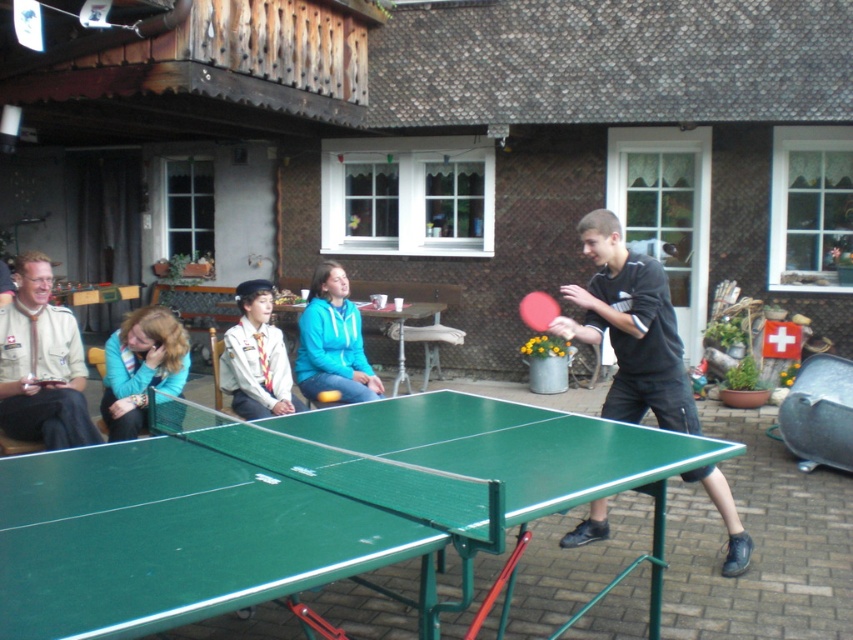
You are standing at the edge of the patio and want to place a large decorative vase between the matte blue jacket at center and the green plastic table tennis table at center. Given that the vase is 1.2 meters wide, can it fit between them?

The matte blue jacket at center has a larger size compared to green plastic table tennis table at center, but the exact distance between them isn t specified. Without knowing the space between the two objects, it s impossible to determine if the vase will fit.

You are standing at the center of the green table tennis table. You want to move to the point marked at coordinate (x=175, y=538). Is this point located on the table?

Yes, the point marked at coordinate (x=175, y=538) is on the green plastic table at center, so you can move there directly.

You are a person who is 5 feet tall. You want to play table tennis with others. Can you comfortably stand between the matte blue jacket at center and the green plastic table tennis table at center without feeling cramped?

The distance between the matte blue jacket at center and the green plastic table tennis table at center is 12.86 inches, which is about 1 foot. Since you are 5 feet tall, this space might feel cramped for standing comfortably between them.